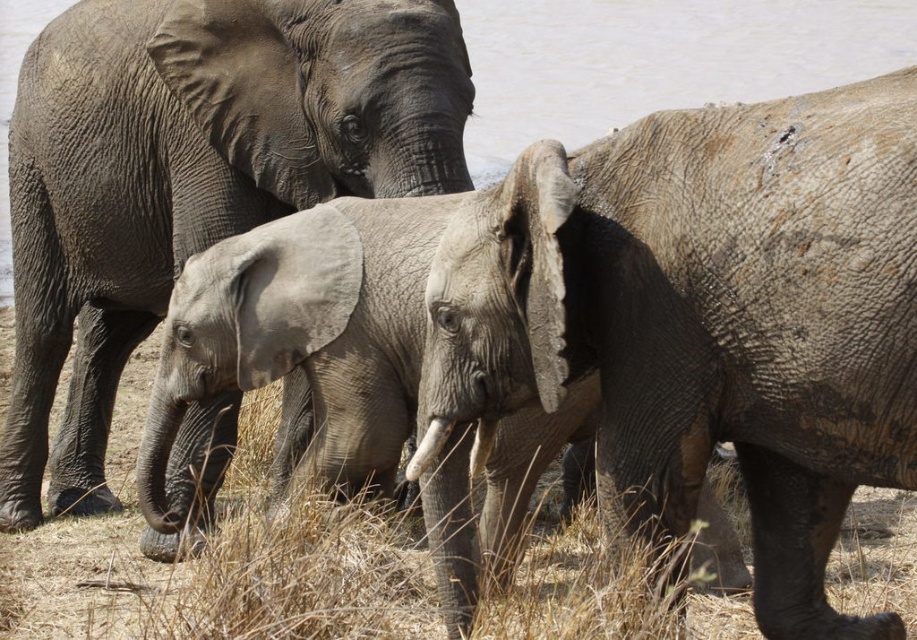
Question: Considering the relative positions of gray rough elephant at center and gray matte elephant at center in the image provided, where is gray rough elephant at center located with respect to gray matte elephant at center?

Choices:
 (A) below
 (B) above

Answer: (A)

Question: Which point is farther to the camera?

Choices:
 (A) gray water at upper center
 (B) gray matte elephant at center

Answer: (A)

Question: Is gray rough elephant at center smaller than gray water at upper center?

Choices:
 (A) yes
 (B) no

Answer: (B)

Question: Which point is farther to the camera?

Choices:
 (A) gray water at upper center
 (B) gray matte elephant at center
 (C) gray rough elephant at center

Answer: (A)

Question: Can you confirm if gray rough elephant at center is positioned below gray water at upper center?

Choices:
 (A) no
 (B) yes

Answer: (B)

Question: Among these objects, which one is nearest to the camera?

Choices:
 (A) gray rough elephant at center
 (B) gray water at upper center
 (C) gray matte elephant at center

Answer: (A)